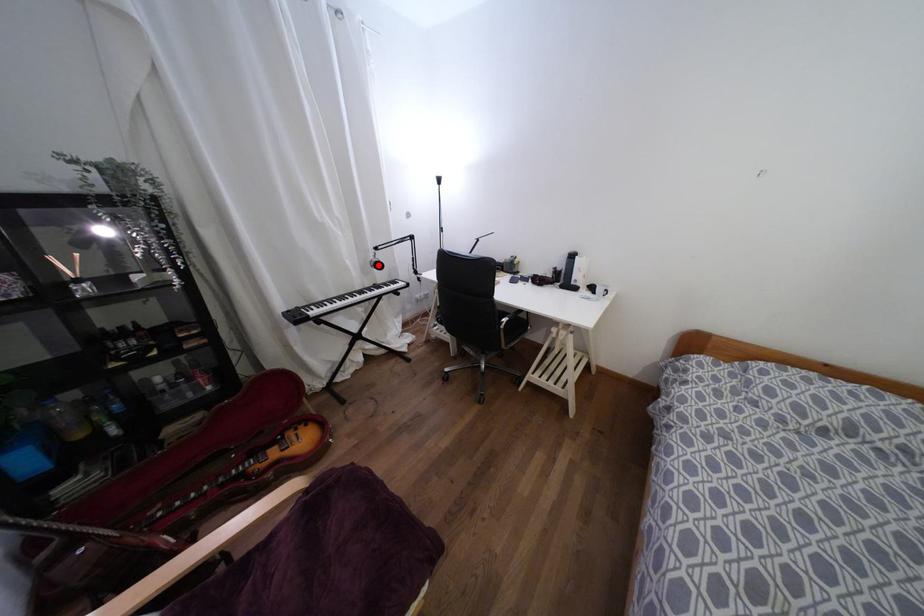
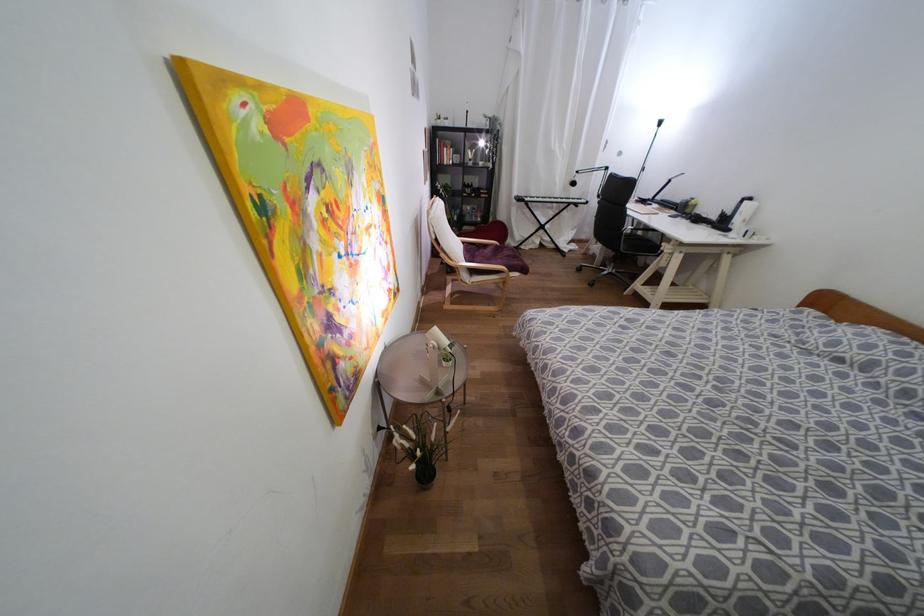
Question: I am providing you with two images of the same scene from different viewpoints. Image1 has a red point marked. In image2, the corresponding 3D location appears at what relative position? Reply with the corresponding letter.

Choices:
 (A) Closer
 (B) Farther

Answer: (A)